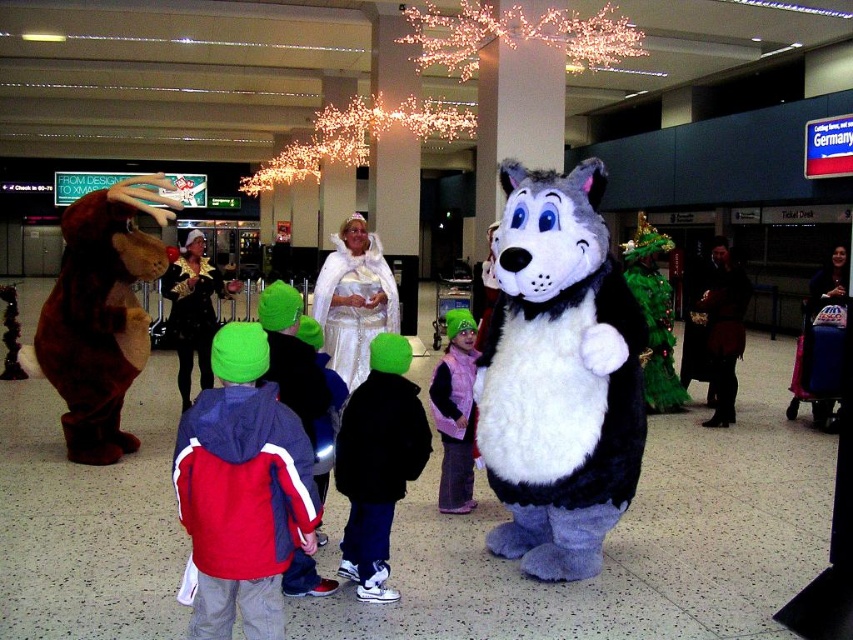
Question: Which of these objects is positioned farthest from the red and white jacket at center?

Choices:
 (A) red and blue jacket at center
 (B) dark brown leather boots at lower right
 (C) white satin dress at center

Answer: (B)

Question: Is fuzzy white and black wolf at center wider than brown plush bear at left?

Choices:
 (A) yes
 (B) no

Answer: (A)

Question: Which object is farther from the camera taking this photo?

Choices:
 (A) white satin dress at center
 (B) velvet purple coat at lower right
 (C) red and blue jacket at center

Answer: (B)

Question: Is red and white jacket at center further to camera compared to dark brown leather boots at lower right?

Choices:
 (A) no
 (B) yes

Answer: (A)

Question: Is red and white jacket at center to the right of velvet purple coat at lower right from the viewer's perspective?

Choices:
 (A) yes
 (B) no

Answer: (B)

Question: Estimate the real-world distances between objects in this image. Which object is farther from the pink fleece vest at center?

Choices:
 (A) brown plush bear at left
 (B) red and blue jacket at center
 (C) green fuzzy hat at center
 (D) fuzzy white and black wolf at center

Answer: (A)